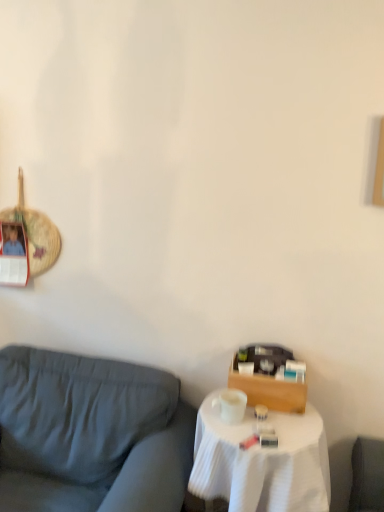
Image resolution: width=384 pixels, height=512 pixels. Describe the element at coordinates (90, 434) in the screenshot. I see `matte gray fabric couch at left` at that location.

Identify the location of matte gray fabric couch at left. (90, 434).

What is the approximate width of matte gray fabric couch at left?

matte gray fabric couch at left is 36.48 inches wide.

Consider the image. What is the approximate height of white cloth-covered table at lower right?

It is 67.14 centimeters.

Describe the element at coordinates (261, 461) in the screenshot. I see `white cloth-covered table at lower right` at that location.

Measure the distance between point (259, 468) and camera.

Point (259, 468) is 1.41 meters from camera.

Where is `white cloth-covered table at lower right`? Image resolution: width=384 pixels, height=512 pixels. white cloth-covered table at lower right is located at coordinates (261, 461).

Where is `matte gray fabric couch at left`? Image resolution: width=384 pixels, height=512 pixels. matte gray fabric couch at left is located at coordinates (90, 434).

Considering the positions of objects matte gray fabric couch at left and white cloth-covered table at lower right in the image provided, who is more to the left, matte gray fabric couch at left or white cloth-covered table at lower right?

From the viewer's perspective, matte gray fabric couch at left appears more on the left side.

Considering the relative positions of matte gray fabric couch at left and white cloth-covered table at lower right in the image provided, is matte gray fabric couch at left in front of white cloth-covered table at lower right?

Yes, it is.

Which is in front, point (168, 388) or point (249, 508)?

Positioned in front is point (249, 508).

From the image's perspective, which one is positioned higher, matte gray fabric couch at left or white cloth-covered table at lower right?

From the image's view, matte gray fabric couch at left is above.

From a real-world perspective, is matte gray fabric couch at left above or below white cloth-covered table at lower right?

In terms of real-world spatial position, matte gray fabric couch at left is above white cloth-covered table at lower right.

Considering the sizes of objects matte gray fabric couch at left and white cloth-covered table at lower right in the image provided, who is wider, matte gray fabric couch at left or white cloth-covered table at lower right?

matte gray fabric couch at left is wider.

Consider the image. Does matte gray fabric couch at left have a greater height compared to white cloth-covered table at lower right?

Yes.

Looking at this image, is matte gray fabric couch at left bigger or smaller than white cloth-covered table at lower right?

matte gray fabric couch at left is bigger than white cloth-covered table at lower right.

Is matte gray fabric couch at left not inside white cloth-covered table at lower right?

Yes, matte gray fabric couch at left is outside of white cloth-covered table at lower right.

Is matte gray fabric couch at left touching white cloth-covered table at lower right?

No, matte gray fabric couch at left is not with white cloth-covered table at lower right.

Is matte gray fabric couch at left positioned with its back to white cloth-covered table at lower right?

That's not correct — matte gray fabric couch at left is not looking away from white cloth-covered table at lower right.

Can you tell me how much matte gray fabric couch at left and white cloth-covered table at lower right differ in facing direction?

matte gray fabric couch at left and white cloth-covered table at lower right are facing 0.998 degrees away from each other.

Measure the distance from matte gray fabric couch at left to white cloth-covered table at lower right.

matte gray fabric couch at left and white cloth-covered table at lower right are 36.84 centimeters apart from each other.

Locate an element on the screen. This screenshot has width=384, height=512. studio couch on the left of the white cloth-covered table at lower right is located at coordinates (90, 434).

Looking at this image, between white cloth-covered table at lower right and matte gray fabric couch at left, which one appears on the left side from the viewer's perspective?

matte gray fabric couch at left.

Based on the photo, does white cloth-covered table at lower right lie in front of matte gray fabric couch at left?

No, white cloth-covered table at lower right is further to the viewer.

Between point (251, 487) and point (16, 436), which one is positioned behind?

The point (16, 436) is farther.

From the image's perspective, which object appears higher, white cloth-covered table at lower right or matte gray fabric couch at left?

From the image's view, matte gray fabric couch at left is above.

From a real-world perspective, does white cloth-covered table at lower right stand above matte gray fabric couch at left?

Incorrect, from a real-world perspective, white cloth-covered table at lower right is lower than matte gray fabric couch at left.

Does white cloth-covered table at lower right have a greater width compared to matte gray fabric couch at left?

No, white cloth-covered table at lower right is not wider than matte gray fabric couch at left.

Considering the relative sizes of white cloth-covered table at lower right and matte gray fabric couch at left in the image provided, is white cloth-covered table at lower right taller than matte gray fabric couch at left?

In fact, white cloth-covered table at lower right may be shorter than matte gray fabric couch at left.

Considering the relative sizes of white cloth-covered table at lower right and matte gray fabric couch at left in the image provided, is white cloth-covered table at lower right bigger than matte gray fabric couch at left?

Incorrect, white cloth-covered table at lower right is not larger than matte gray fabric couch at left.

Is white cloth-covered table at lower right inside or outside of matte gray fabric couch at left?

white cloth-covered table at lower right is not inside matte gray fabric couch at left, it's outside.

Is white cloth-covered table at lower right next to matte gray fabric couch at left?

No, white cloth-covered table at lower right is not beside matte gray fabric couch at left.

Is white cloth-covered table at lower right oriented away from matte gray fabric couch at left?

No, white cloth-covered table at lower right is not facing away from matte gray fabric couch at left.

Can you tell me how much white cloth-covered table at lower right and matte gray fabric couch at left differ in facing direction?

The facing directions of white cloth-covered table at lower right and matte gray fabric couch at left are 0.998 degrees apart.

How far apart are white cloth-covered table at lower right and matte gray fabric couch at left?

A distance of 14.50 inches exists between white cloth-covered table at lower right and matte gray fabric couch at left.

This screenshot has width=384, height=512. In the image, there is a matte gray fabric couch at left. Find the location of `table below it (from the image's perspective)`. table below it (from the image's perspective) is located at coordinates (261, 461).

The image size is (384, 512). In order to click on studio couch that is in front of the white cloth-covered table at lower right in this screenshot , I will do `click(90, 434)`.

The image size is (384, 512). What are the coordinates of `studio couch above the white cloth-covered table at lower right (from the image's perspective)` in the screenshot? It's located at (90, 434).